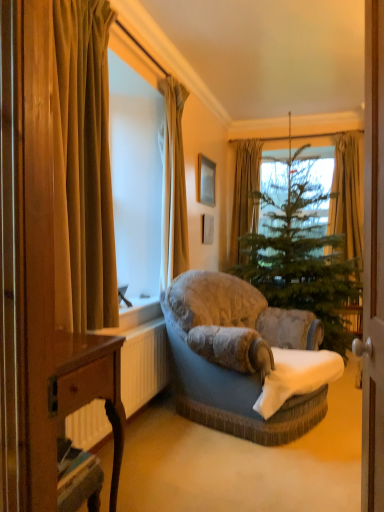
Question: Should I look upward or downward to see silky beige curtain at upper center, which is the second curtain in left-to-right order?

Choices:
 (A) down
 (B) up

Answer: (B)

Question: Is white plastic radiator at lower left taller than wooden picture frame at upper center?

Choices:
 (A) yes
 (B) no

Answer: (A)

Question: Is white plastic radiator at lower left aimed at wooden picture frame at upper center?

Choices:
 (A) yes
 (B) no

Answer: (B)

Question: From the image's perspective, would you say white plastic radiator at lower left is shown under wooden picture frame at upper center?

Choices:
 (A) no
 (B) yes

Answer: (B)

Question: Is white plastic radiator at lower left oriented away from wooden picture frame at upper center?

Choices:
 (A) yes
 (B) no

Answer: (B)

Question: Does white plastic radiator at lower left have a lesser height compared to wooden picture frame at upper center?

Choices:
 (A) no
 (B) yes

Answer: (A)

Question: Can you confirm if white plastic radiator at lower left is thinner than wooden picture frame at upper center?

Choices:
 (A) no
 (B) yes

Answer: (A)

Question: Can you confirm if wooden desk at lower left is wider than velvet gold curtain at left, which is counted as the first curtain, starting from the front?

Choices:
 (A) no
 (B) yes

Answer: (B)

Question: Considering the relative sizes of wooden desk at lower left and velvet gold curtain at left, the fourth curtain viewed from the back, in the image provided, is wooden desk at lower left shorter than velvet gold curtain at left, the fourth curtain viewed from the back,?

Choices:
 (A) no
 (B) yes

Answer: (B)

Question: Is wooden desk at lower left with velvet gold curtain at left, marked as the first curtain in a left-to-right arrangement?

Choices:
 (A) no
 (B) yes

Answer: (A)

Question: Can you confirm if wooden desk at lower left is positioned to the right of velvet gold curtain at left, which is counted as the first curtain, starting from the front?

Choices:
 (A) yes
 (B) no

Answer: (A)

Question: Is wooden desk at lower left taller than velvet gold curtain at left, marked as the first curtain in a left-to-right arrangement?

Choices:
 (A) yes
 (B) no

Answer: (B)

Question: From the image's perspective, is wooden desk at lower left under velvet gold curtain at left, which is counted as the first curtain, starting from the front?

Choices:
 (A) yes
 (B) no

Answer: (A)

Question: Is velvet gold curtain at left, arranged as the 4th curtain when viewed from the right, not near green fabric curtain at upper center, the first curtain positioned from the back?

Choices:
 (A) no
 (B) yes

Answer: (B)